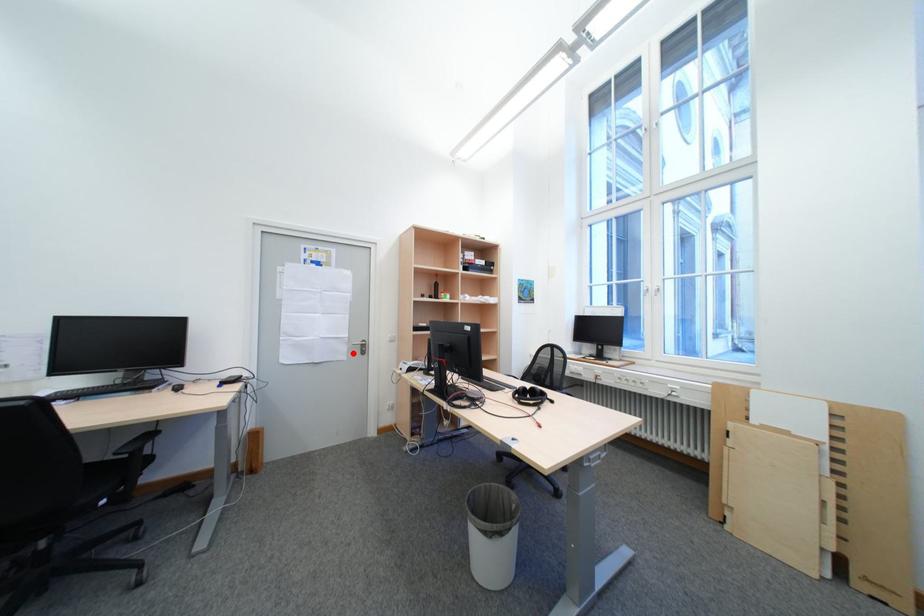
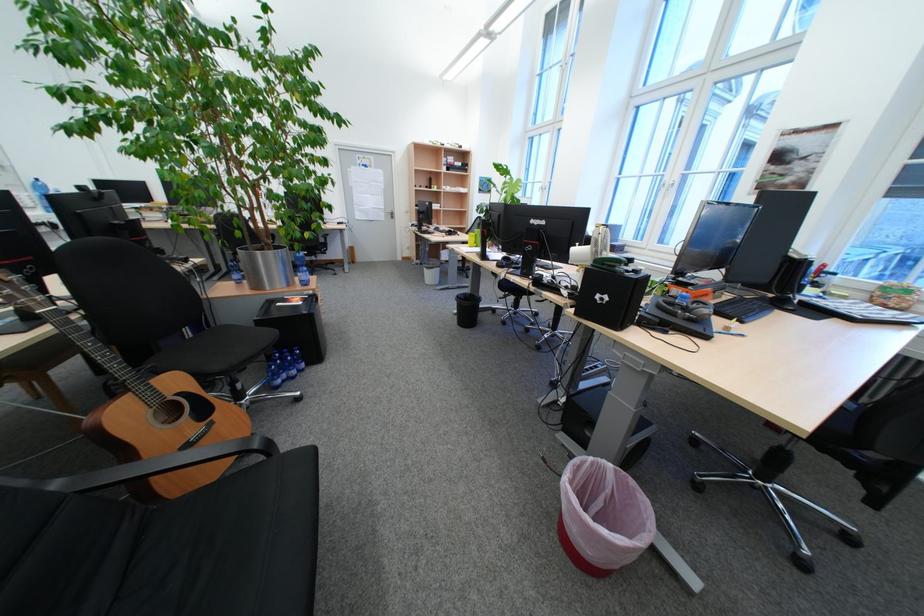
The point at the highlighted location is marked in the first image. Where is the corresponding point in the second image?

(394, 217)